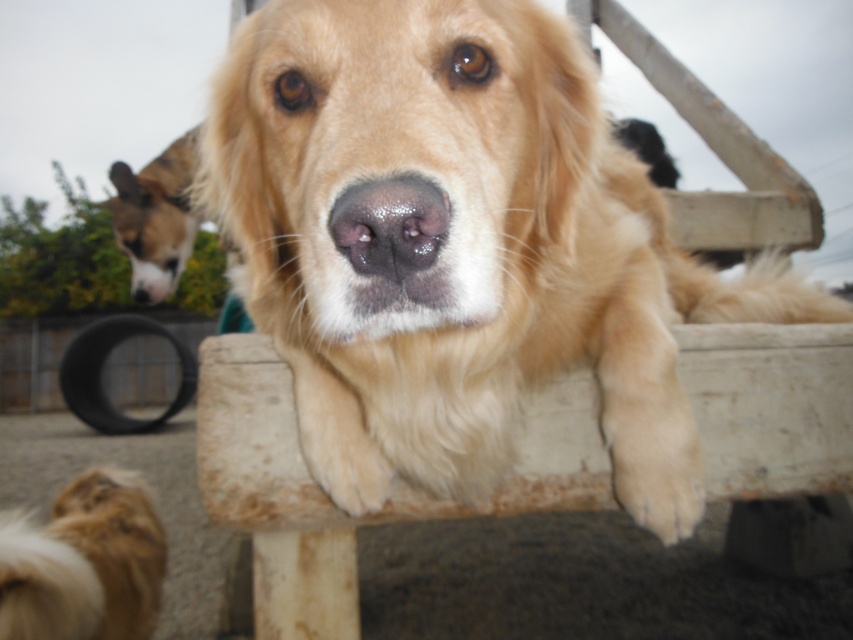
Is golden retriever at center positioned before brown fur dog at left?

Yes, golden retriever at center is in front of brown fur dog at left.

Which is more to the right, golden retriever at center or brown fur dog at left?

golden retriever at center is more to the right.

Who is more forward, [473,256] or [151,195]?

Point [473,256]

Identify the location of golden retriever at center. (457, 246).

Is golden retriever at center closer to camera compared to fuzzy brown fur at lower left?

That is True.

Between golden retriever at center and fuzzy brown fur at lower left, which one is positioned lower?

Positioned lower is fuzzy brown fur at lower left.

Between point (292, 356) and point (119, 547), which one is positioned in front?

Point (292, 356) is in front.

The height and width of the screenshot is (640, 853). I want to click on golden retriever at center, so pos(457,246).

Can you confirm if fuzzy brown fur at lower left is taller than brown fur dog at left?

Incorrect, fuzzy brown fur at lower left's height is not larger of brown fur dog at left's.

From the picture: Does fuzzy brown fur at lower left have a greater width compared to brown fur dog at left?

No.

Which is in front, point (120, 513) or point (160, 209)?

Point (120, 513) is more forward.

Image resolution: width=853 pixels, height=640 pixels. I want to click on fuzzy brown fur at lower left, so click(x=84, y=563).